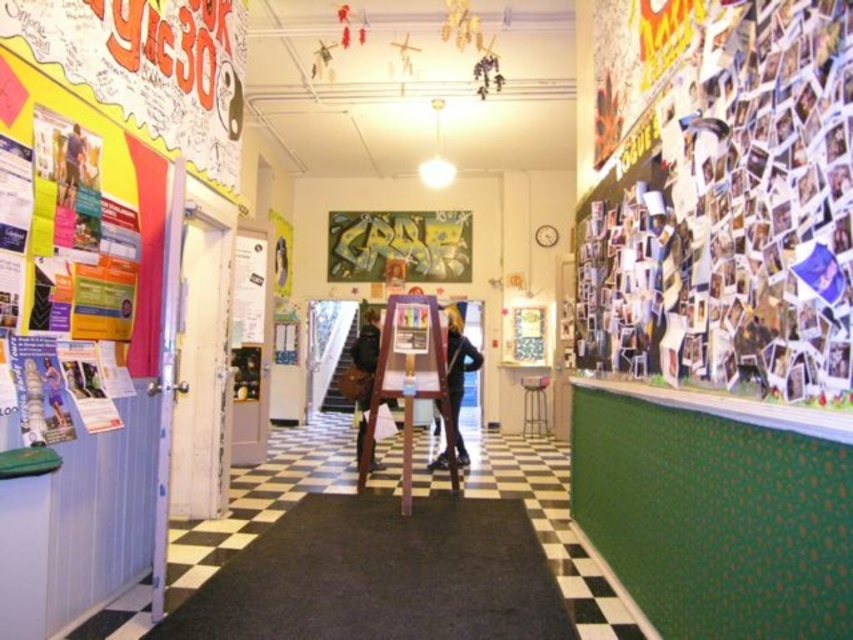
Question: Is green matte poster at center positioned in front of black leather pants at center?

Choices:
 (A) no
 (B) yes

Answer: (A)

Question: Does black leather pants at center appear over dark brown leather jacket at center?

Choices:
 (A) yes
 (B) no

Answer: (A)

Question: Which of the following is the closest to the observer?

Choices:
 (A) metallic stool at center
 (B) multicolored collage at right
 (C) black leather pants at center

Answer: (B)

Question: Among these points, which one is nearest to the camera?

Choices:
 (A) (376, 461)
 (B) (471, 365)
 (C) (540, 390)
 (D) (451, 275)

Answer: (A)

Question: Where is green matte poster at center located in relation to dark brown leather jacket at center in the image?

Choices:
 (A) right
 (B) left

Answer: (A)

Question: Which is nearer to the green matte poster at center?

Choices:
 (A) multicolored collage at right
 (B) metallic stool at center
 (C) dark brown leather jacket at center
 (D) black leather pants at center

Answer: (B)